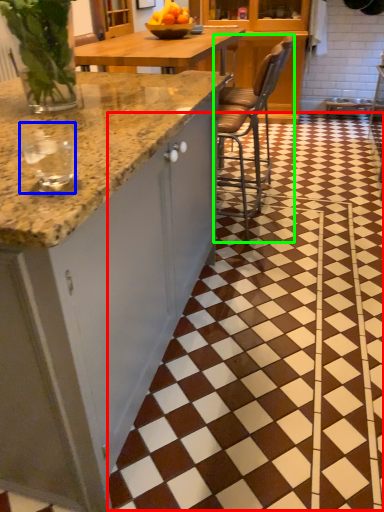
Question: Which object is the farthest from tile (highlighted by a red box)? Choose among these: wine glass (highlighted by a blue box) or chair (highlighted by a green box).

Choices:
 (A) wine glass
 (B) chair

Answer: (A)